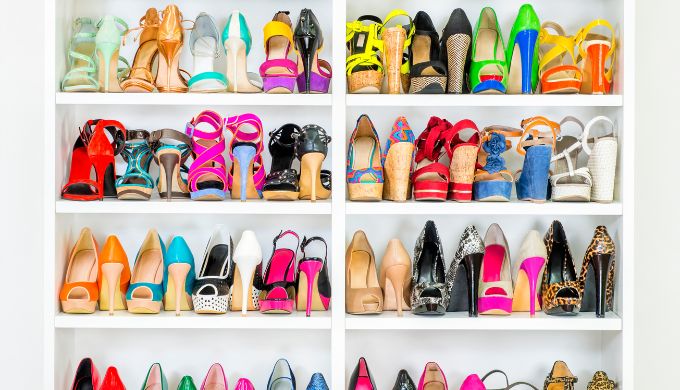
This screenshot has width=680, height=390. What are the coordinates of `white shelves` in the screenshot? It's located at (156, 97), (163, 212), (160, 322), (407, 326), (420, 205), (413, 95).